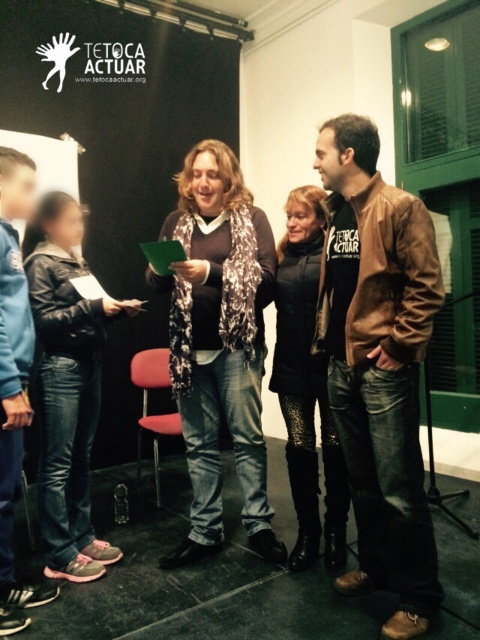
Question: Can you confirm if metallic red chair at center is positioned above green matte folder at center?

Choices:
 (A) no
 (B) yes

Answer: (A)

Question: Can you confirm if silver metallic scarf at center is wider than blue fleece jacket at lower left?

Choices:
 (A) yes
 (B) no

Answer: (A)

Question: Which object appears closest to the camera in this image?

Choices:
 (A) silver metallic scarf at center
 (B) blue fleece jacket at lower left
 (C) metallic red chair at center
 (D) brown leather jacket at center

Answer: (D)

Question: Observing the image, what is the correct spatial positioning of silver metallic scarf at center in reference to black quilted jacket at center?

Choices:
 (A) left
 (B) right

Answer: (A)

Question: Which point appears closest to the camera in this image?

Choices:
 (A) (147, 429)
 (B) (176, 256)

Answer: (B)

Question: Which point appears farthest from the camera in this image?

Choices:
 (A) (104, 342)
 (B) (287, 394)

Answer: (A)